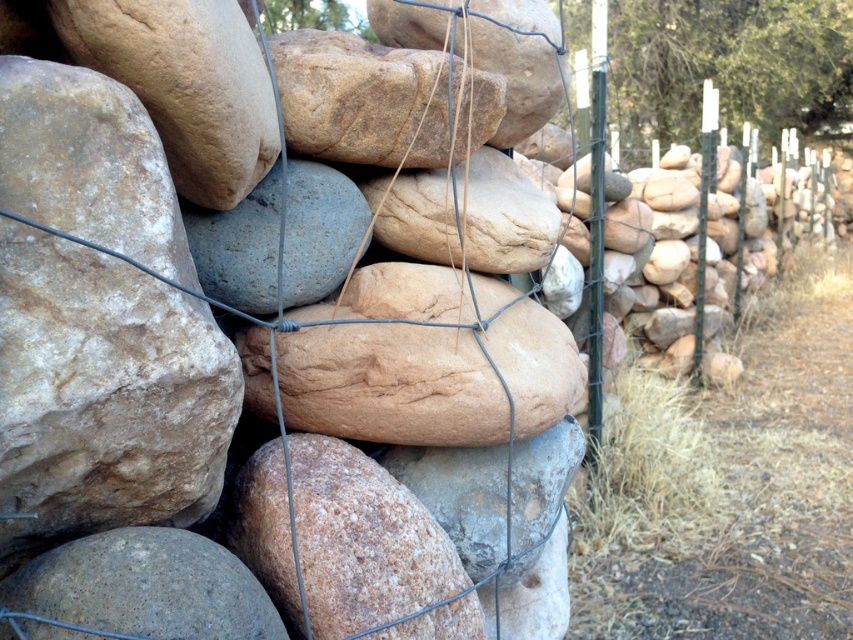
Question: Which of these objects is positioned closest to the smooth brown rock at center?

Choices:
 (A) brown rough boulder at center
 (B) natural stone at center

Answer: (A)

Question: Where is natural stone at center located in relation to smooth brown rock at center in the image?

Choices:
 (A) above
 (B) below

Answer: (B)

Question: Does brown rough boulder at center have a larger size compared to smooth brown rock at center?

Choices:
 (A) no
 (B) yes

Answer: (A)

Question: Does brown rough boulder at center have a larger size compared to smooth brown rock at center?

Choices:
 (A) yes
 (B) no

Answer: (B)

Question: Which point is farther from the camera taking this photo?

Choices:
 (A) (520, 90)
 (B) (352, 138)

Answer: (A)

Question: Which object is farther from the camera taking this photo?

Choices:
 (A) brown rough boulder at center
 (B) smooth brown rock at center

Answer: (B)